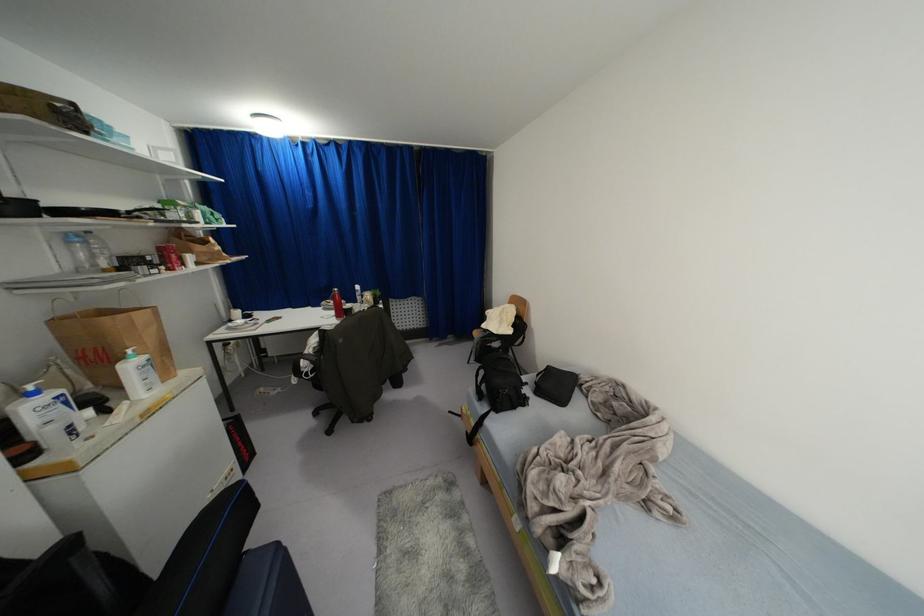
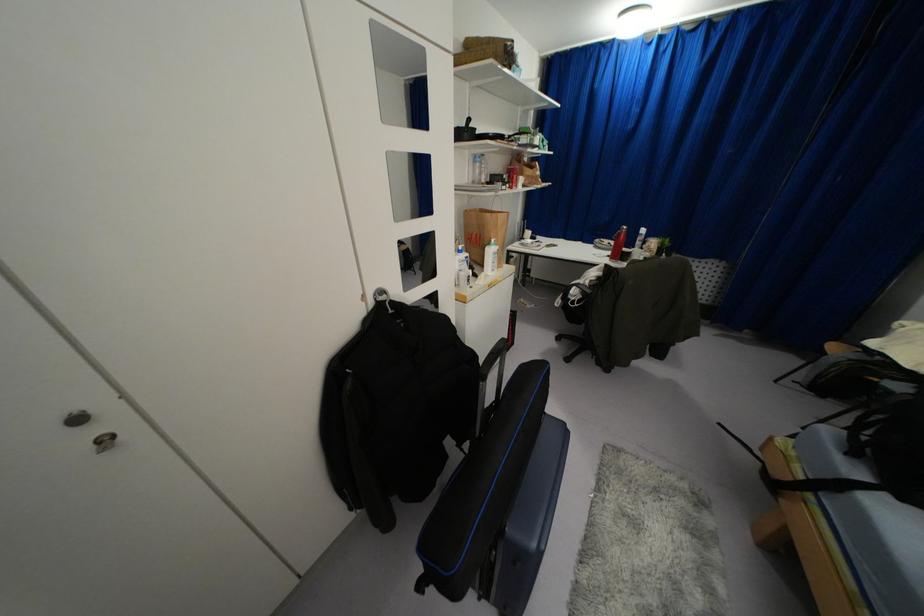
The point at (142, 355) is marked in the first image. Where is the corresponding point in the second image?

(495, 246)